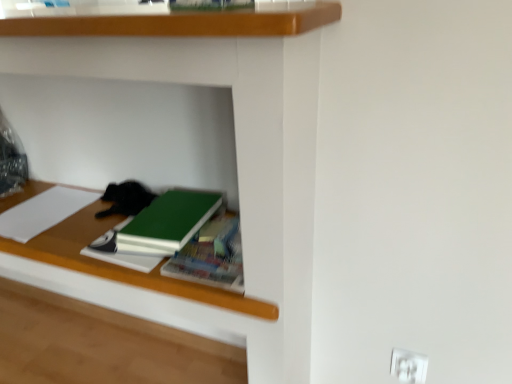
Question: Is green matte book at center, the 2th book in the right-to-left sequence, shorter than wooden shelf at center?

Choices:
 (A) no
 (B) yes

Answer: (B)

Question: Is green matte book at center, acting as the 2th book starting from the left, smaller than wooden shelf at center?

Choices:
 (A) yes
 (B) no

Answer: (A)

Question: From a real-world perspective, is green matte book at center, the 2th book in the right-to-left sequence, physically above wooden shelf at center?

Choices:
 (A) yes
 (B) no

Answer: (A)

Question: Is green matte book at center, the 2th book in the right-to-left sequence, completely or partially outside of wooden shelf at center?

Choices:
 (A) no
 (B) yes

Answer: (A)

Question: Is green matte book at center, the 2th book in the right-to-left sequence, positioned before wooden shelf at center?

Choices:
 (A) no
 (B) yes

Answer: (A)

Question: Is green matte book at center, the 2th book in the right-to-left sequence, at the left side of wooden shelf at center?

Choices:
 (A) yes
 (B) no

Answer: (B)

Question: Is green matte book at center, which is the first book from right to left, at the left side of wooden shelf at center?

Choices:
 (A) yes
 (B) no

Answer: (B)

Question: Does green matte book at center, placed as the third book when sorted from left to right, lie in front of wooden shelf at center?

Choices:
 (A) no
 (B) yes

Answer: (A)

Question: Is the surface of green matte book at center, which is the first book from right to left, in direct contact with wooden shelf at center?

Choices:
 (A) no
 (B) yes

Answer: (A)

Question: Is the position of green matte book at center, which is the first book from right to left, more distant than that of wooden shelf at center?

Choices:
 (A) no
 (B) yes

Answer: (B)

Question: Considering the relative sizes of green matte book at center, which is the first book from right to left, and wooden shelf at center in the image provided, is green matte book at center, which is the first book from right to left, taller than wooden shelf at center?

Choices:
 (A) yes
 (B) no

Answer: (B)

Question: Is green matte book at center, which is the first book from right to left, outside wooden shelf at center?

Choices:
 (A) no
 (B) yes

Answer: (A)

Question: From a real-world perspective, is green matte notebook at center physically below black fur cat at center?

Choices:
 (A) yes
 (B) no

Answer: (A)